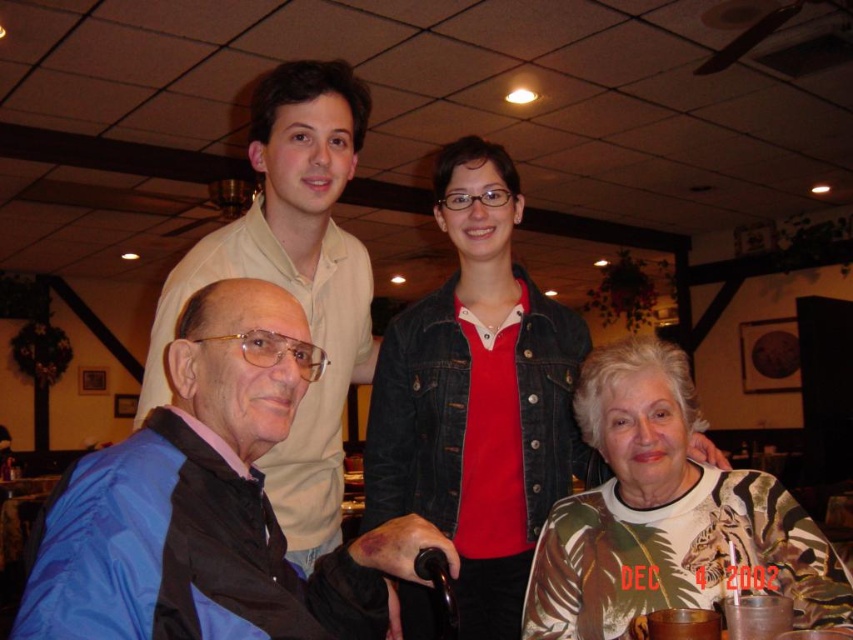
You are a person who wants to reach the blue fabric at lower left without moving your legs. Can you do it?

The blue fabric at lower left is 25.57 inches away, so yes, you can reach it without moving your legs if your arm span is at least 25.57 inches.

In the scene described, there are two shirts visible. The printed fabric shirt at center and the matte beige shirt at upper left. Which of these shirts is shorter in height?

The printed fabric shirt at center has a lesser height compared to matte beige shirt at upper left, so the printed fabric shirt at center is shorter in height.